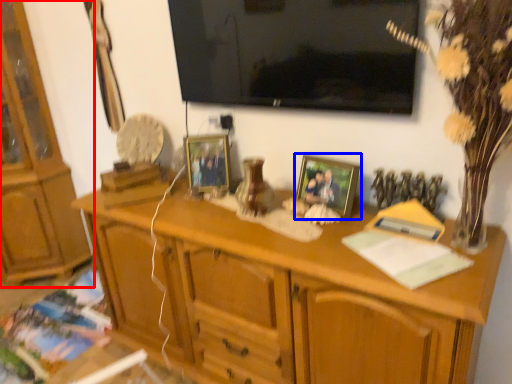
Question: Which object appears farthest to the camera in this image, cabinetry (highlighted by a red box) or picture frame (highlighted by a blue box)?

Choices:
 (A) cabinetry
 (B) picture frame

Answer: (A)